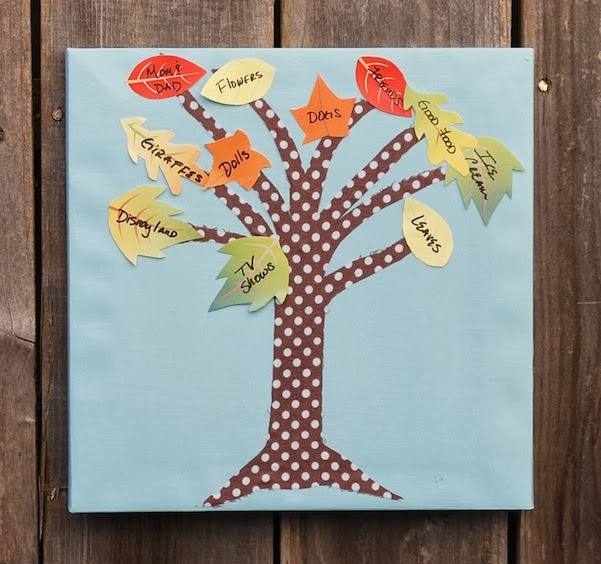
Identify the location of vertical wood slats. (583, 185), (395, 32), (160, 24), (19, 76).